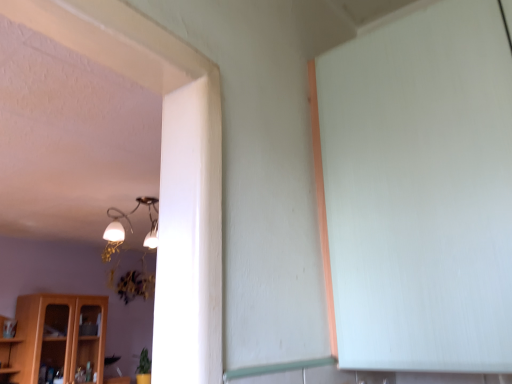
Find the location of a particular element. green matte plant at lower left is located at coordinates (144, 363).

Measure the distance between green matte plant at lower left and camera.

A distance of 4.31 meters exists between green matte plant at lower left and camera.

Describe the element at coordinates (144, 363) in the screenshot. I see `green matte plant at lower left` at that location.

The height and width of the screenshot is (384, 512). Find the location of `green matte plant at lower left`. green matte plant at lower left is located at coordinates (144, 363).